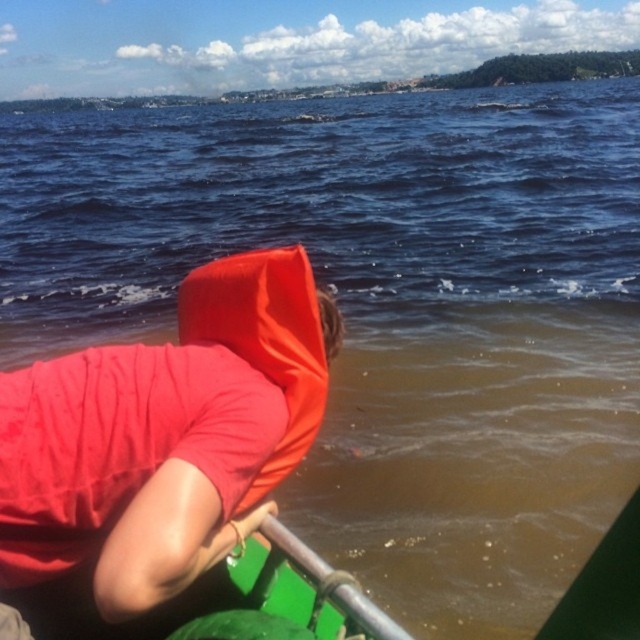
Which of these two, matte red life vest at left or matte orange life jacket at center, stands shorter?

Standing shorter between the two is matte orange life jacket at center.

From the picture: Who is more distant from viewer, [224,257] or [250,288]?

The point [224,257] is more distant.

Does point (81, 378) come behind point (278, 461)?

No, (81, 378) is closer to viewer.

You are a GUI agent. You are given a task and a screenshot of the screen. Output one action in this format:
    pyautogui.click(x=<x>, y=<y>)
    Task: Click on the matte red life vest at left
    
    Given the screenshot: What is the action you would take?
    pyautogui.click(x=166, y=426)